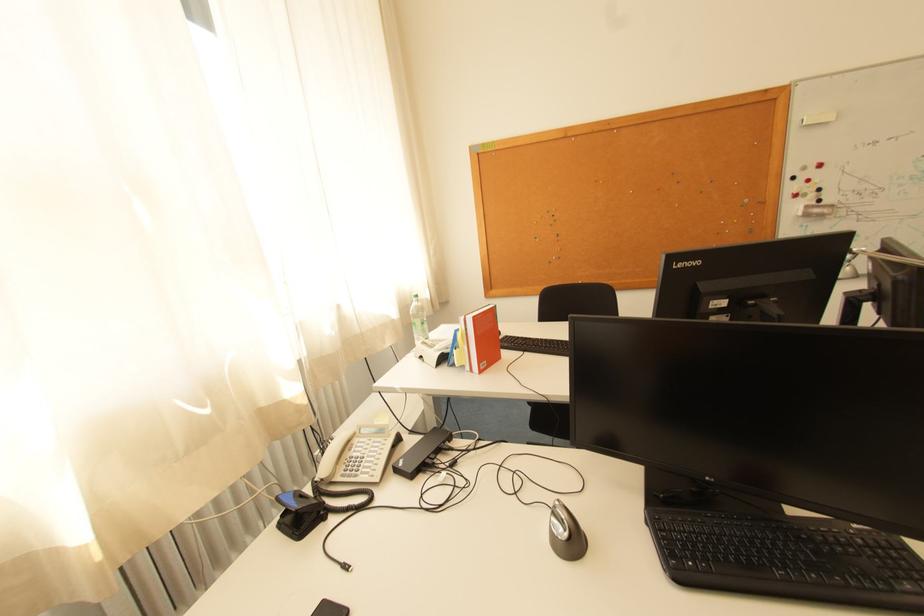
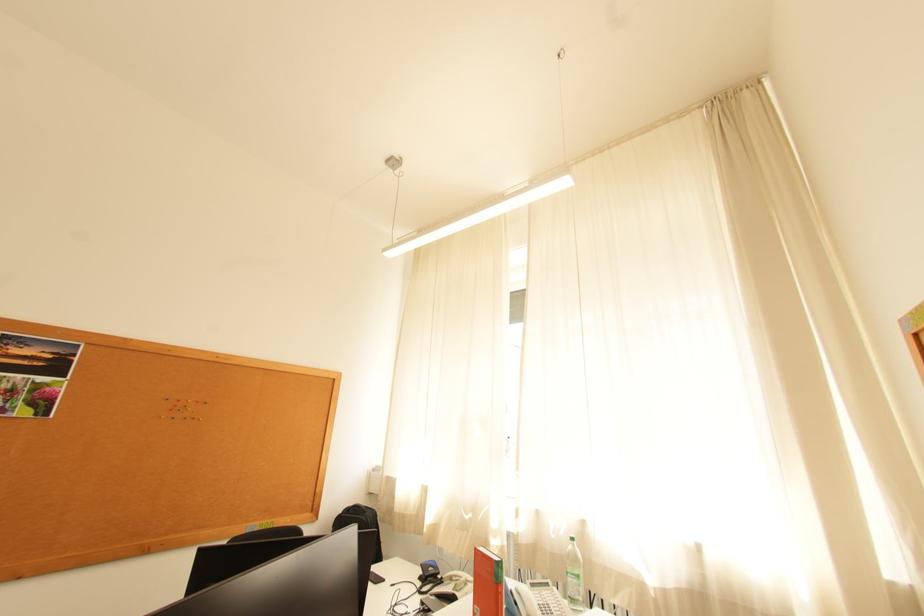
Find the pixel in the second image that matches point 345,329 in the first image.

(569, 536)